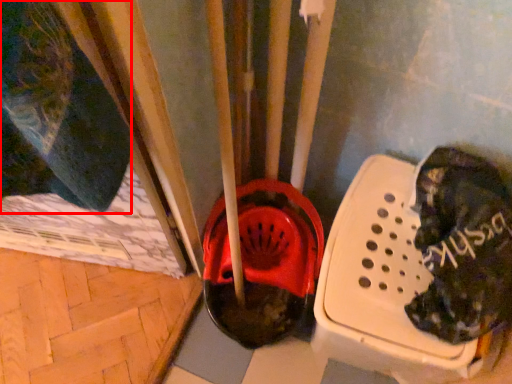
Question: From the image's perspective, where is clothing (annotated by the red box) located relative to footwear?

Choices:
 (A) above
 (B) below

Answer: (A)